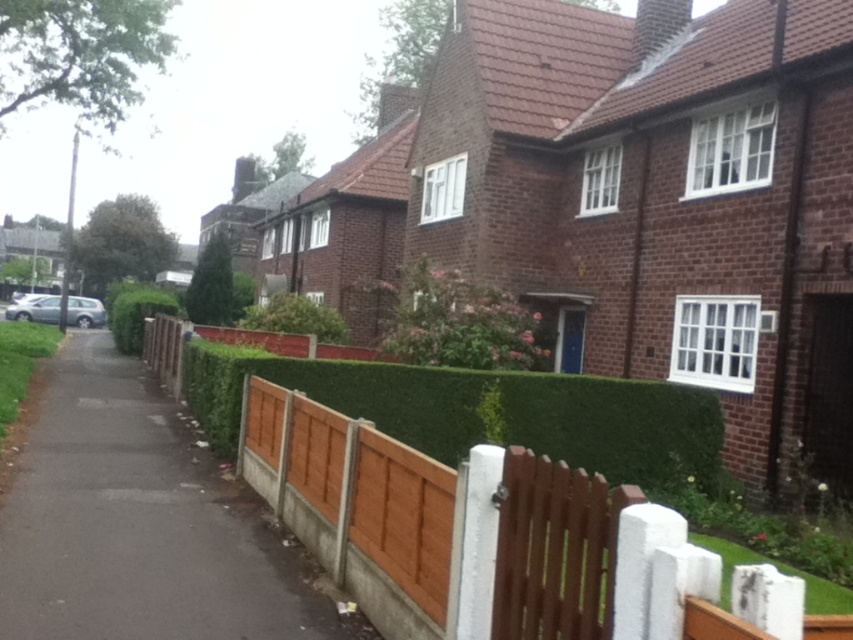
Question: Which point is closer to the camera?

Choices:
 (A) green hedge at center
 (B) brown wooden fence at center

Answer: (B)

Question: Is brown wooden fence at lower center smaller than green hedge at center?

Choices:
 (A) no
 (B) yes

Answer: (A)

Question: Considering the real-world distances, which object is farthest from the green hedge at center?

Choices:
 (A) brown wooden fence at center
 (B) brown wooden fence at lower center

Answer: (A)

Question: Does brown wooden fence at lower center appear over green hedge at center?

Choices:
 (A) yes
 (B) no

Answer: (B)

Question: Does brown wooden fence at lower center have a smaller size compared to green hedge at center?

Choices:
 (A) yes
 (B) no

Answer: (B)

Question: Which object appears closest to the camera in this image?

Choices:
 (A) brown wooden fence at lower center
 (B) green hedge at center
 (C) brown wooden fence at center

Answer: (C)